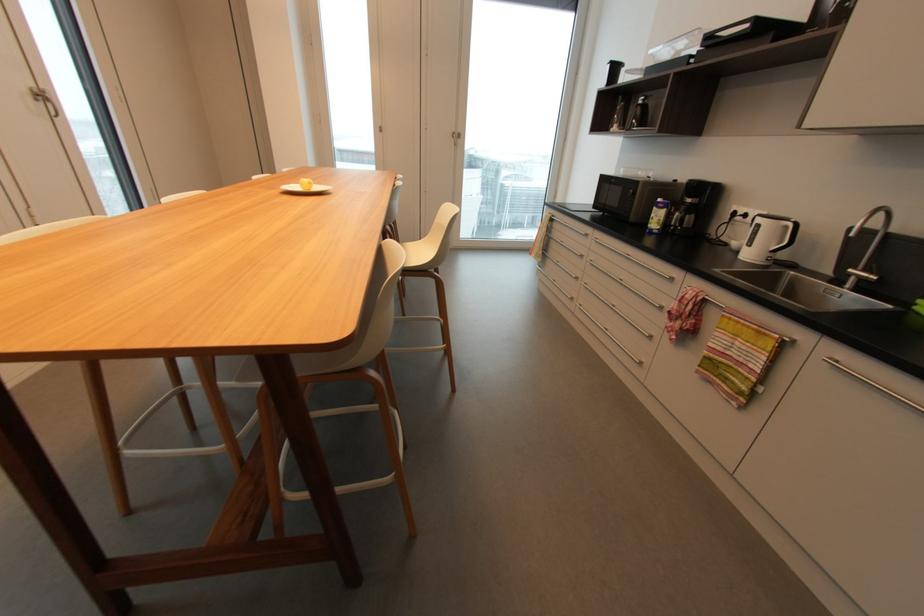
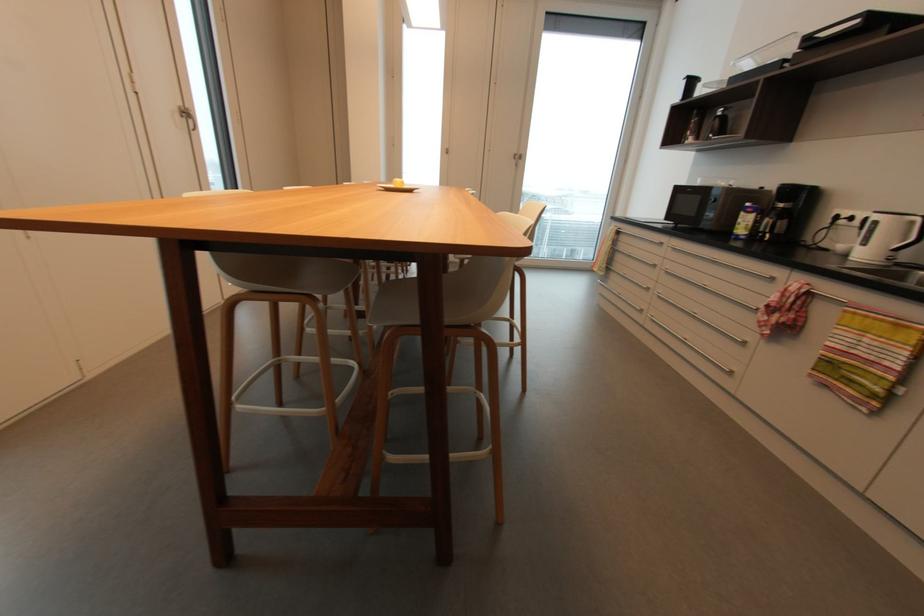
Question: The images are taken continuously from a first-person perspective. In which direction are you moving?

Choices:
 (A) Left
 (B) Right
 (C) Forward
 (D) Backward

Answer: (A)